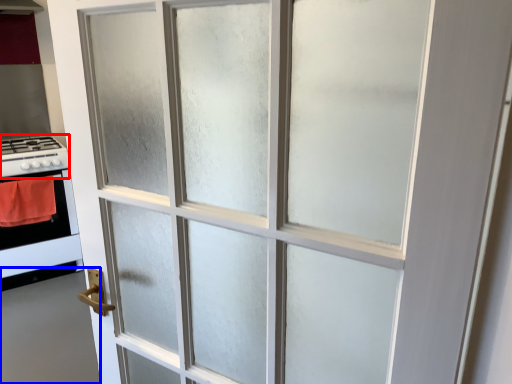
Question: Which object is further to the camera taking this photo, gas stove (highlighted by a red box) or door (highlighted by a blue box)?

Choices:
 (A) gas stove
 (B) door

Answer: (A)